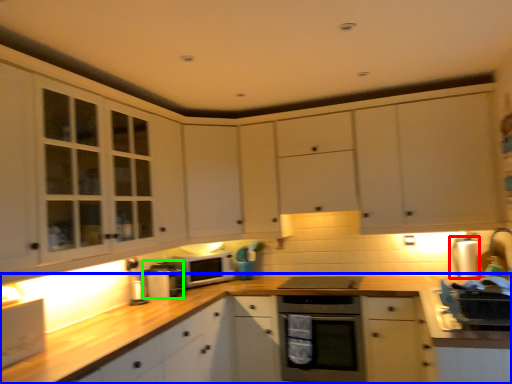
Question: Estimate the real-world distances between objects in this image. Which object is farther from appliance (highlighted by a red box), countertop (highlighted by a blue box) or appliance (highlighted by a green box)?

Choices:
 (A) countertop
 (B) appliance

Answer: (B)